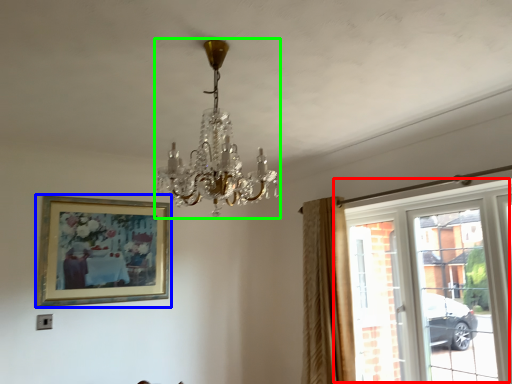
Question: Which is nearer to the window (highlighted by a red box)? picture frame (highlighted by a blue box) or lamp (highlighted by a green box).

Choices:
 (A) picture frame
 (B) lamp

Answer: (B)